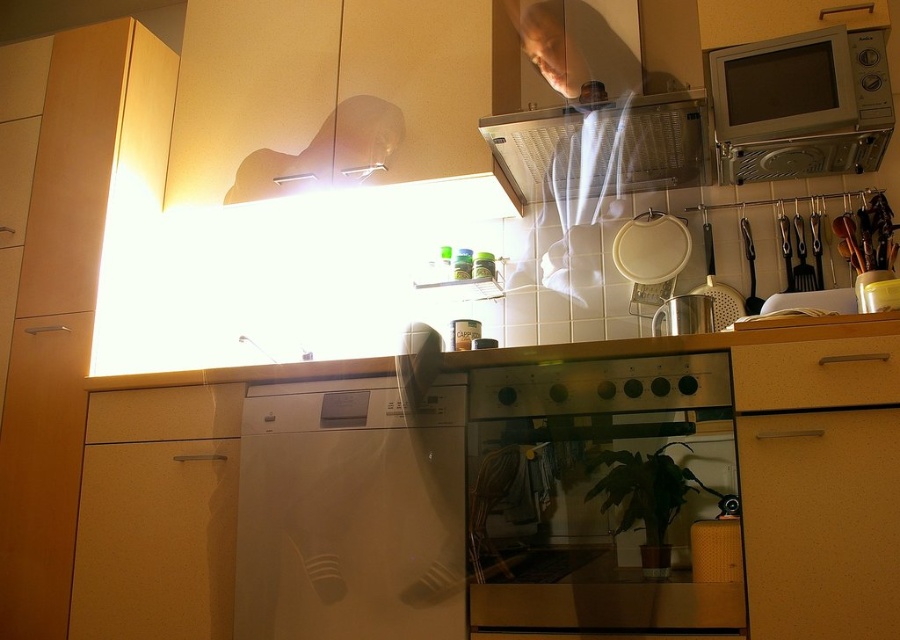
Question: Which object is farther from the camera taking this photo?

Choices:
 (A) white glossy dishwasher at center
 (B) silver metallic microwave at upper right
 (C) white fabric at upper center

Answer: (C)

Question: Considering the real-world distances, which object is farthest from the metallic grid exhaust hood at upper center?

Choices:
 (A) light brown matte drawer at lower right
 (B) silver metallic microwave at upper right

Answer: (A)

Question: Can you confirm if silver metallic microwave at upper right is smaller than matte wood drawer at lower left?

Choices:
 (A) no
 (B) yes

Answer: (A)

Question: Considering the real-world distances, which object is closest to the matte wood drawer at lower left?

Choices:
 (A) white glossy dishwasher at center
 (B) white fabric at upper center
 (C) satin silver oven at center
 (D) metallic grid exhaust hood at upper center

Answer: (A)

Question: Can you confirm if white glossy dishwasher at center is positioned below metallic grid exhaust hood at upper center?

Choices:
 (A) yes
 (B) no

Answer: (A)

Question: Is silver metallic microwave at upper right above metallic grid exhaust hood at upper center?

Choices:
 (A) yes
 (B) no

Answer: (A)